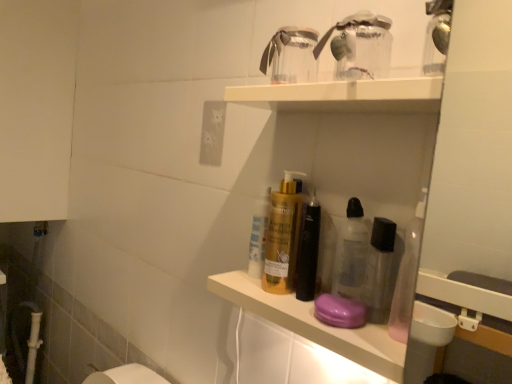
The width and height of the screenshot is (512, 384). What do you see at coordinates (362, 139) in the screenshot?
I see `transparent plastic shelf at upper center` at bounding box center [362, 139].

Identify the location of transparent plastic shelf at upper center. Image resolution: width=512 pixels, height=384 pixels. (362, 139).

Image resolution: width=512 pixels, height=384 pixels. What do you see at coordinates (212, 133) in the screenshot?
I see `white matte electric outlet at upper center` at bounding box center [212, 133].

Find the location of a particular element. The height and width of the screenshot is (384, 512). white matte electric outlet at upper center is located at coordinates (212, 133).

Locate an element on the screen. This screenshot has height=384, width=512. transparent plastic shelf at upper center is located at coordinates (362, 139).

Visually, is transparent plastic shelf at upper center positioned to the left or to the right of white matte electric outlet at upper center?

Clearly, transparent plastic shelf at upper center is on the right of white matte electric outlet at upper center in the image.

Is the depth of transparent plastic shelf at upper center less than that of white matte electric outlet at upper center?

Yes, it is.

Is point (362, 106) closer or farther from the camera than point (213, 132)?

Point (362, 106) is positioned closer to the camera compared to point (213, 132).

From the image's perspective, relative to white matte electric outlet at upper center, is transparent plastic shelf at upper center above or below?

Based on their image positions, transparent plastic shelf at upper center is located beneath white matte electric outlet at upper center.

From a real-world perspective, which object stands above the other?

From a 3D spatial view, transparent plastic shelf at upper center is above.

Between transparent plastic shelf at upper center and white matte electric outlet at upper center, which one has larger width?

With larger width is transparent plastic shelf at upper center.

Is transparent plastic shelf at upper center taller than white matte electric outlet at upper center?

Yes, transparent plastic shelf at upper center is taller than white matte electric outlet at upper center.

Can you confirm if transparent plastic shelf at upper center is smaller than white matte electric outlet at upper center?

No.

Is transparent plastic shelf at upper center outside of white matte electric outlet at upper center?

Yes, transparent plastic shelf at upper center is located beyond the bounds of white matte electric outlet at upper center.

Is transparent plastic shelf at upper center not close to white matte electric outlet at upper center?

transparent plastic shelf at upper center is actually quite close to white matte electric outlet at upper center.

Is transparent plastic shelf at upper center oriented towards white matte electric outlet at upper center?

No, transparent plastic shelf at upper center is not oriented towards white matte electric outlet at upper center.

Can you tell me how much transparent plastic shelf at upper center and white matte electric outlet at upper center differ in facing direction?

transparent plastic shelf at upper center and white matte electric outlet at upper center are facing 0.0569 degrees away from each other.

Based on the photo, measure the distance between transparent plastic shelf at upper center and white matte electric outlet at upper center.

transparent plastic shelf at upper center is 13.37 inches from white matte electric outlet at upper center.

The width and height of the screenshot is (512, 384). In the image, there is a transparent plastic shelf at upper center. Find the location of `electric outlet above it (from the image's perspective)`. electric outlet above it (from the image's perspective) is located at coordinates (212, 133).

Based on the photo, can you confirm if white matte electric outlet at upper center is positioned to the left of transparent plastic shelf at upper center?

Indeed, white matte electric outlet at upper center is positioned on the left side of transparent plastic shelf at upper center.

In the image, is white matte electric outlet at upper center positioned in front of or behind transparent plastic shelf at upper center?

Visually, white matte electric outlet at upper center is located behind transparent plastic shelf at upper center.

Is point (200, 149) positioned behind point (399, 209)?

That is True.

From the image's perspective, is white matte electric outlet at upper center located above transparent plastic shelf at upper center?

Yes, from the image's perspective, white matte electric outlet at upper center is over transparent plastic shelf at upper center.

Based on the photo, from a real-world perspective, is white matte electric outlet at upper center physically above transparent plastic shelf at upper center?

No, from a real-world perspective, white matte electric outlet at upper center is not above transparent plastic shelf at upper center.

Considering the relative sizes of white matte electric outlet at upper center and transparent plastic shelf at upper center in the image provided, is white matte electric outlet at upper center wider than transparent plastic shelf at upper center?

No.

Considering the relative sizes of white matte electric outlet at upper center and transparent plastic shelf at upper center in the image provided, is white matte electric outlet at upper center taller than transparent plastic shelf at upper center?

Incorrect, the height of white matte electric outlet at upper center is not larger of that of transparent plastic shelf at upper center.

Which of these two, white matte electric outlet at upper center or transparent plastic shelf at upper center, is bigger?

With larger size is transparent plastic shelf at upper center.

Do you think white matte electric outlet at upper center is within transparent plastic shelf at upper center, or outside of it?

white matte electric outlet at upper center is located beyond the bounds of transparent plastic shelf at upper center.

Are white matte electric outlet at upper center and transparent plastic shelf at upper center located far from each other?

They are positioned close to each other.

Is white matte electric outlet at upper center looking in the opposite direction of transparent plastic shelf at upper center?

That's not correct — white matte electric outlet at upper center is not looking away from transparent plastic shelf at upper center.

This screenshot has width=512, height=384. I want to click on electric outlet that is on the left side of transparent plastic shelf at upper center, so click(212, 133).

Identify the location of shelf in front of the white matte electric outlet at upper center. The width and height of the screenshot is (512, 384). (362, 139).

The height and width of the screenshot is (384, 512). I want to click on electric outlet lying behind the transparent plastic shelf at upper center, so click(212, 133).